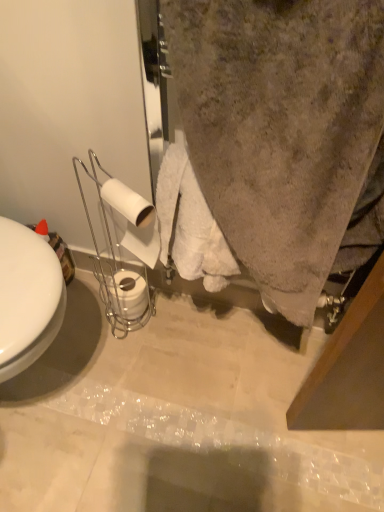
Locate an element on the screen. This screenshot has width=384, height=512. vacant area that is in front of white matte toilet paper at lower center, the 1th toilet paper viewed from the back is located at coordinates (124, 362).